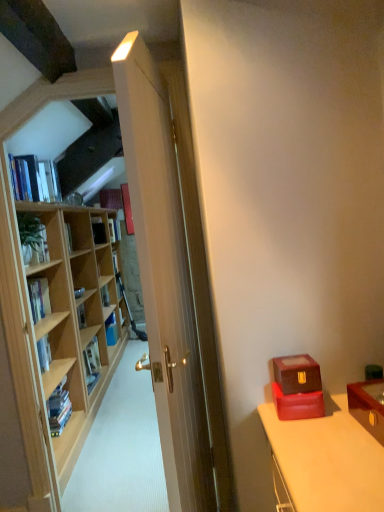
Question: Can you confirm if green matte plant at left, the 4th book from the front, is wider than hardcover book at left, arranged as the sixth book when viewed from the back?

Choices:
 (A) yes
 (B) no

Answer: (A)

Question: Considering the relative positions of green matte plant at left, the 7th book in the back-to-front sequence, and hardcover book at left, which appears as the fifth book when viewed from the front, in the image provided, is green matte plant at left, the 7th book in the back-to-front sequence, to the right of hardcover book at left, which appears as the fifth book when viewed from the front, from the viewer's perspective?

Choices:
 (A) no
 (B) yes

Answer: (A)

Question: Considering the relative sizes of green matte plant at left, the 4th book from the front, and hardcover book at left, arranged as the sixth book when viewed from the back, in the image provided, is green matte plant at left, the 4th book from the front, bigger than hardcover book at left, arranged as the sixth book when viewed from the back,?

Choices:
 (A) yes
 (B) no

Answer: (A)

Question: Is green matte plant at left, the 7th book in the back-to-front sequence, taller than hardcover book at left, which appears as the fifth book when viewed from the front?

Choices:
 (A) no
 (B) yes

Answer: (B)

Question: Can you confirm if green matte plant at left, the 4th book from the front, is thinner than hardcover book at left, which appears as the fifth book when viewed from the front?

Choices:
 (A) yes
 (B) no

Answer: (B)

Question: Does green matte plant at left, the 4th book from the front, touch hardcover book at left, which appears as the fifth book when viewed from the front?

Choices:
 (A) no
 (B) yes

Answer: (A)

Question: Is green matte plant at left, the 7th book in the back-to-front sequence, completely or partially inside wooden bookshelf at left, the fifth book when ordered from back to front?

Choices:
 (A) yes
 (B) no

Answer: (B)

Question: Does wooden bookshelf at left, arranged as the 6th book when viewed from the front, have a larger size compared to green matte plant at left, the 7th book in the back-to-front sequence?

Choices:
 (A) yes
 (B) no

Answer: (A)

Question: Considering the relative sizes of wooden bookshelf at left, arranged as the 6th book when viewed from the front, and green matte plant at left, the 7th book in the back-to-front sequence, in the image provided, is wooden bookshelf at left, arranged as the 6th book when viewed from the front, taller than green matte plant at left, the 7th book in the back-to-front sequence,?

Choices:
 (A) no
 (B) yes

Answer: (A)

Question: Is wooden bookshelf at left, arranged as the 6th book when viewed from the front, touching green matte plant at left, the 4th book from the front?

Choices:
 (A) yes
 (B) no

Answer: (B)

Question: Is wooden bookshelf at left, arranged as the 6th book when viewed from the front, oriented towards green matte plant at left, the 4th book from the front?

Choices:
 (A) yes
 (B) no

Answer: (B)

Question: Is wooden bookshelf at left, the fifth book when ordered from back to front, at the left side of green matte plant at left, the 4th book from the front?

Choices:
 (A) yes
 (B) no

Answer: (A)

Question: Is hardcover book at center, which is the ninth book from front to back, closer to the viewer compared to hardcover book at left, placed as the ninth book when sorted from back to front?

Choices:
 (A) no
 (B) yes

Answer: (A)